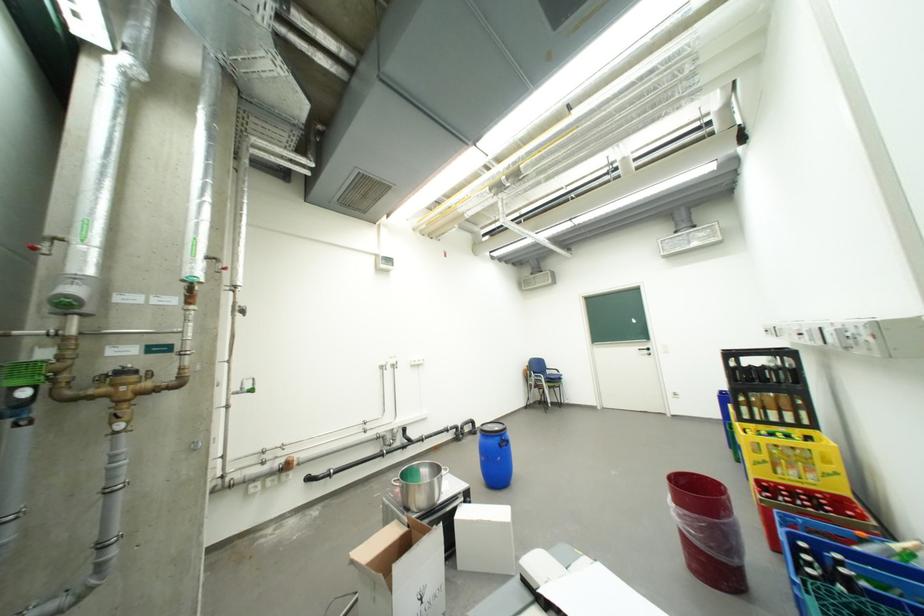
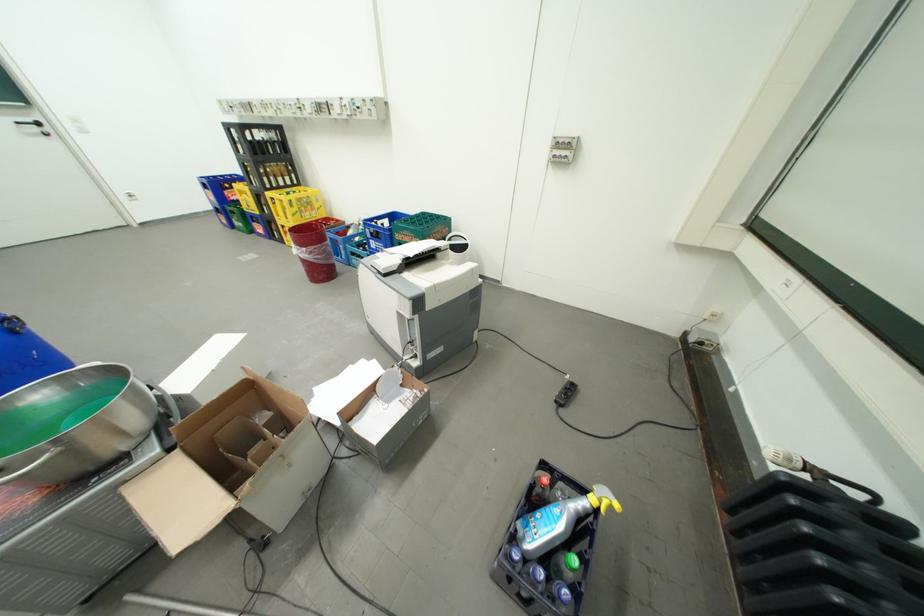
In the second image, find the point that corresponds to point (685, 507) in the first image.

(314, 249)